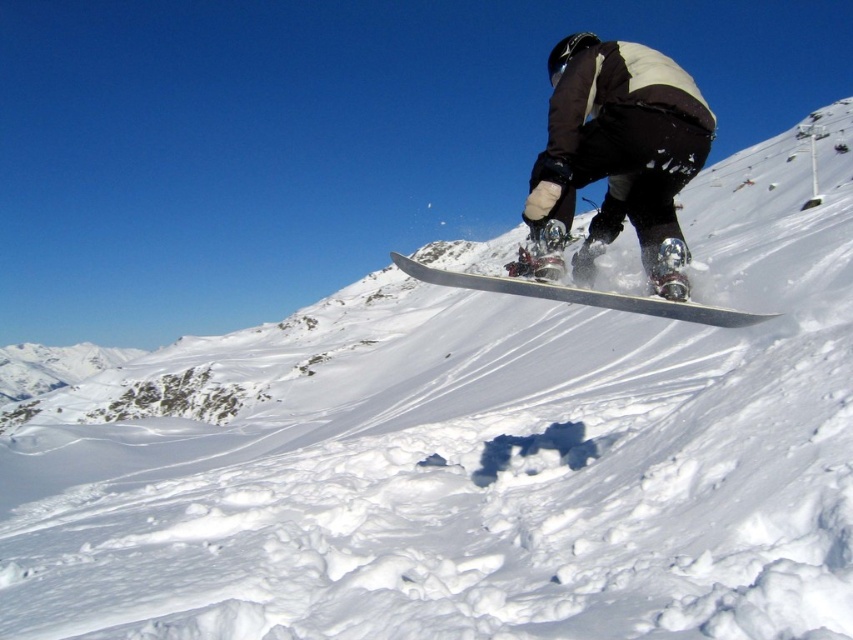
Can you confirm if black matte snowboarder at center is positioned below silver metallic snowboard at center?

Incorrect, black matte snowboarder at center is not positioned below silver metallic snowboard at center.

Between point (564, 189) and point (718, 321), which one is positioned behind?

The point (564, 189) is behind.

You are a GUI agent. You are given a task and a screenshot of the screen. Output one action in this format:
    pyautogui.click(x=<x>, y=<y>)
    Task: Click on the black matte snowboarder at center
    
    Given the screenshot: What is the action you would take?
    pyautogui.click(x=619, y=150)

Who is more forward, (548, 292) or (664, 88)?

Point (548, 292) is more forward.

Is white matte snowboard at center above black matte snowboarder at center?

No.

Where is `white matte snowboard at center`? Image resolution: width=853 pixels, height=640 pixels. white matte snowboard at center is located at coordinates (610, 179).

Which of these two, white matte snowboard at center or silver metallic snowboard at center, stands taller?

Standing taller between the two is white matte snowboard at center.

Is white matte snowboard at center bigger than silver metallic snowboard at center?

Yes, white matte snowboard at center is bigger than silver metallic snowboard at center.

Identify the location of white matte snowboard at center. This screenshot has height=640, width=853. (610, 179).

Image resolution: width=853 pixels, height=640 pixels. In order to click on white matte snowboard at center in this screenshot , I will do `click(610, 179)`.